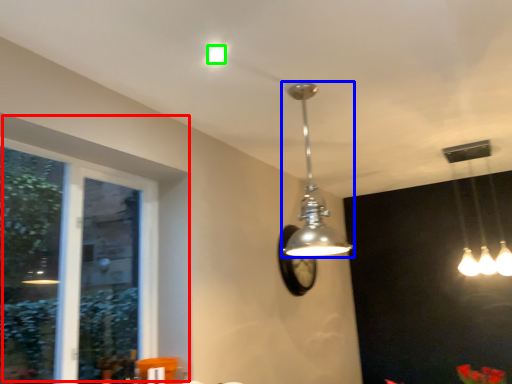
Question: Which object is the closest to the window (highlighted by a red box)? Choose among these: lamp (highlighted by a blue box) or droplight (highlighted by a green box).

Choices:
 (A) lamp
 (B) droplight

Answer: (A)